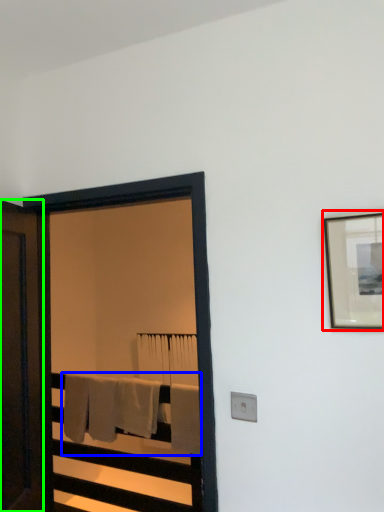
Question: Which is farther away from picture frame (highlighted by a red box)? bath towel (highlighted by a blue box) or door (highlighted by a green box)?

Choices:
 (A) bath towel
 (B) door

Answer: (A)